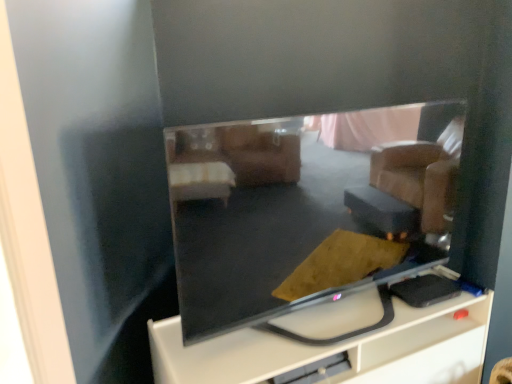
Question: Relative to matte black tv at center, is matte black tv at center in front or behind?

Choices:
 (A) behind
 (B) front

Answer: (B)

Question: Is matte black tv at center wider or thinner than matte black tv at center?

Choices:
 (A) thin
 (B) wide

Answer: (A)

Question: From the image's perspective, is matte black tv at center above or below matte black tv at center?

Choices:
 (A) below
 (B) above

Answer: (B)

Question: From a real-world perspective, is matte black tv at center above or below matte black tv at center?

Choices:
 (A) above
 (B) below

Answer: (B)

Question: Based on their positions, is matte black tv at center located to the left or right of matte black tv at center?

Choices:
 (A) left
 (B) right

Answer: (B)

Question: Is point (257, 354) closer or farther from the camera than point (352, 147)?

Choices:
 (A) closer
 (B) farther

Answer: (A)

Question: Considering the positions of matte black tv at center and matte black tv at center in the image, is matte black tv at center wider or thinner than matte black tv at center?

Choices:
 (A) wide
 (B) thin

Answer: (A)